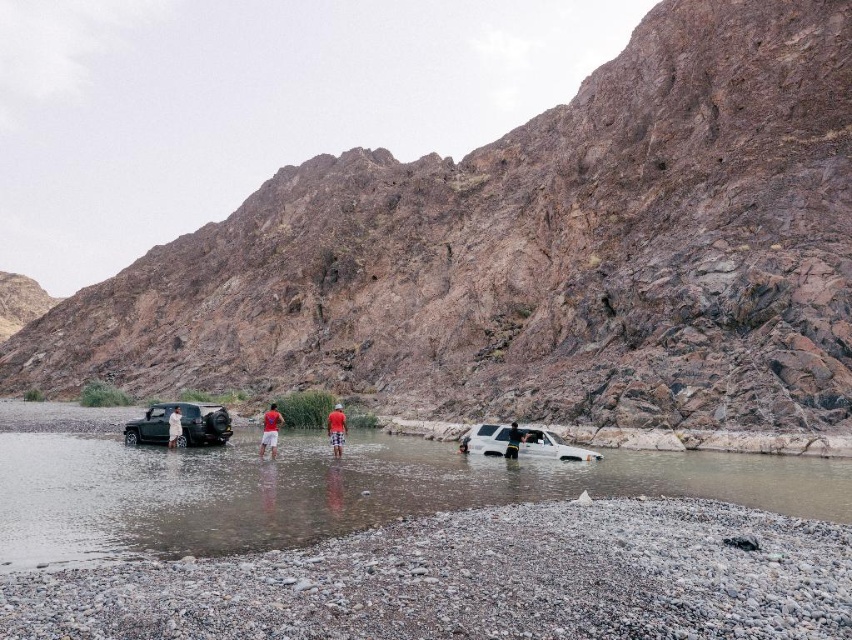
Is clear water at center shorter than red cotton shirt at center?

Yes.

Who is shorter, clear water at center or red cotton shirt at center?

With less height is clear water at center.

The height and width of the screenshot is (640, 852). What do you see at coordinates (335, 490) in the screenshot? I see `clear water at center` at bounding box center [335, 490].

The image size is (852, 640). Identify the location of clear water at center. (335, 490).

Based on the photo, how distant is clear water at center from red plaid shorts at center?

18.16 meters

Is clear water at center thinner than red plaid shorts at center?

In fact, clear water at center might be wider than red plaid shorts at center.

What do you see at coordinates (335, 490) in the screenshot? The image size is (852, 640). I see `clear water at center` at bounding box center [335, 490].

At what (x,y) coordinates should I click in order to perform the action: click on clear water at center. Please return your answer as a coordinate pair (x, y). The height and width of the screenshot is (640, 852). Looking at the image, I should click on (335, 490).

Can you confirm if shiny black jeep at lower left is positioned to the right of white matte suv at center?

In fact, shiny black jeep at lower left is to the left of white matte suv at center.

Who is shorter, shiny black jeep at lower left or white matte suv at center?

Standing shorter between the two is white matte suv at center.

Between point (145, 435) and point (469, 440), which one is positioned behind?

Positioned behind is point (145, 435).

This screenshot has width=852, height=640. I want to click on shiny black jeep at lower left, so click(181, 424).